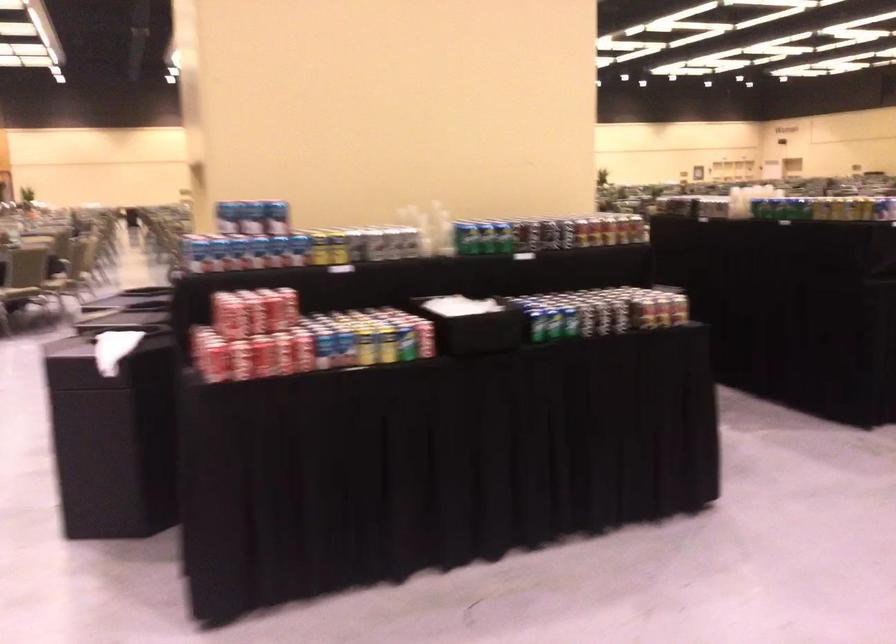
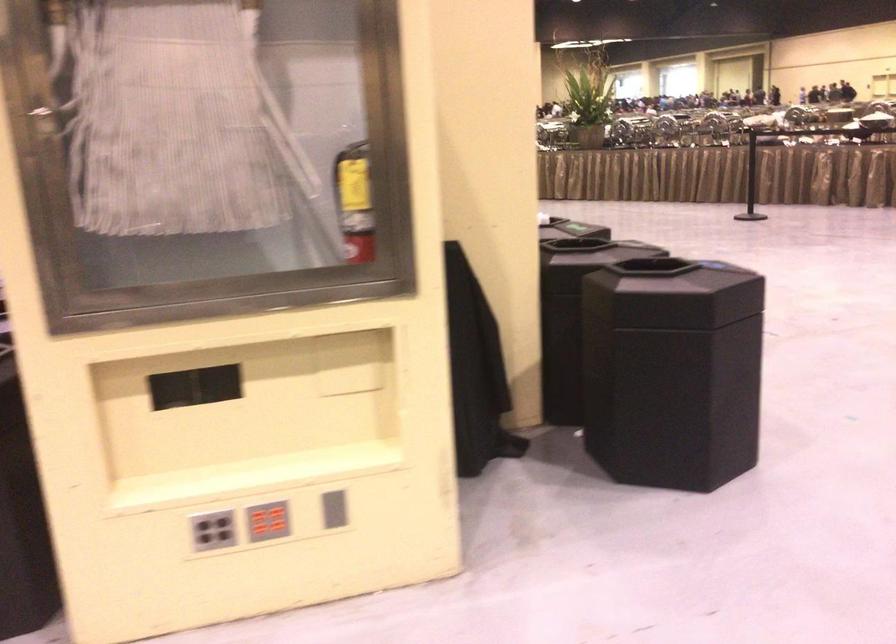
Question: I am providing you with two images of the same scene from different viewpoints. After the viewpoint changes to image2, which objects are now occluded?

Choices:
 (A) silver soda can
 (B) grey vertical slot
 (C) red wall button
 (D) black trash can lid

Answer: (A)